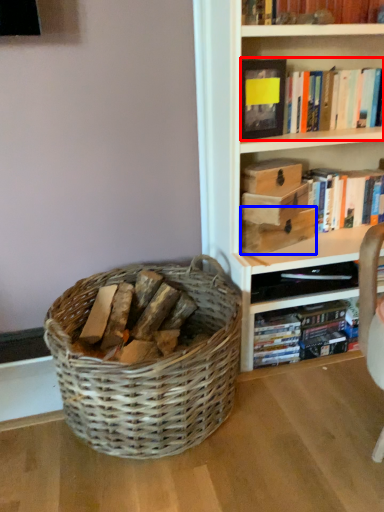
Question: Which point is further to the camera, book (highlighted by a red box) or storage box (highlighted by a blue box)?

Choices:
 (A) book
 (B) storage box

Answer: (B)